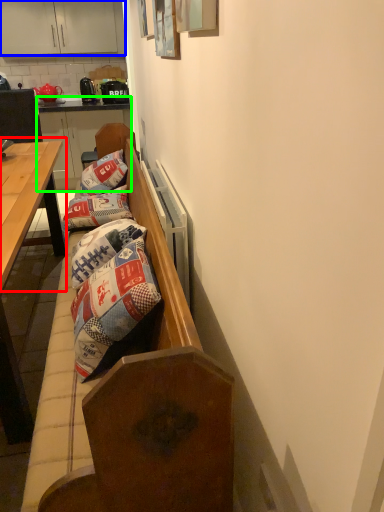
Question: Considering the real-world distances, which object is farthest from table (highlighted by a red box)? cabinetry (highlighted by a blue box) or dresser (highlighted by a green box)?

Choices:
 (A) cabinetry
 (B) dresser

Answer: (A)